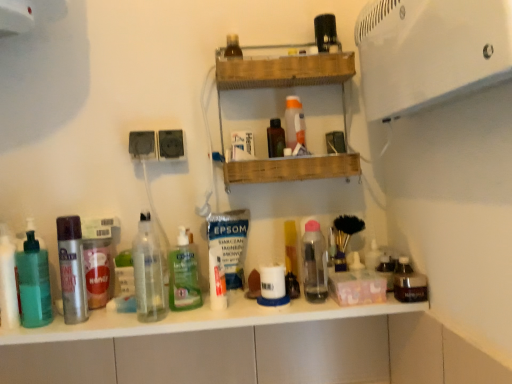
I want to click on vacant area located to the right-hand side of translucent plastic soap dispenser at left, the 5th bottle viewed from the right, so click(x=93, y=326).